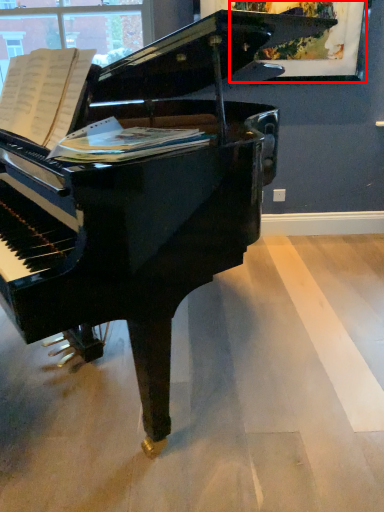
Question: From the image's perspective, considering the relative positions of picture frame (annotated by the red box) and sheet music in the image provided, where is picture frame (annotated by the red box) located with respect to the staircase?

Choices:
 (A) below
 (B) above

Answer: (B)